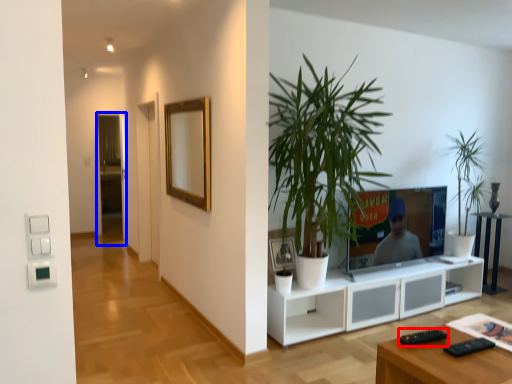
Question: Which object appears closest to the camera in this image, remote (highlighted by a red box) or glass door (highlighted by a blue box)?

Choices:
 (A) remote
 (B) glass door

Answer: (A)